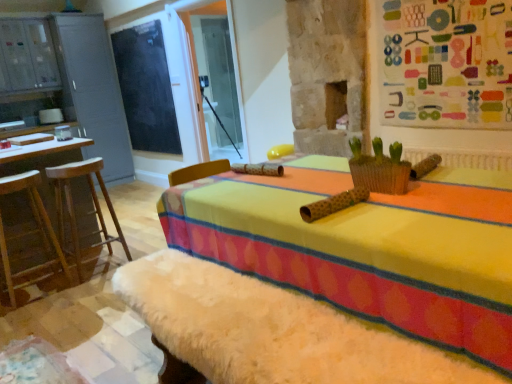
Question: Can woven brown basket at center be found inside blackboard at upper left?

Choices:
 (A) no
 (B) yes

Answer: (A)

Question: Does blackboard at upper left have a greater height compared to woven brown basket at center?

Choices:
 (A) yes
 (B) no

Answer: (A)

Question: From the image's perspective, is blackboard at upper left under woven brown basket at center?

Choices:
 (A) no
 (B) yes

Answer: (A)

Question: Is woven brown basket at center at the back of blackboard at upper left?

Choices:
 (A) yes
 (B) no

Answer: (B)

Question: Is blackboard at upper left further to camera compared to woven brown basket at center?

Choices:
 (A) yes
 (B) no

Answer: (A)

Question: Is blackboard at upper left in front of woven brown basket at center?

Choices:
 (A) no
 (B) yes

Answer: (A)

Question: Could matte gray cabinet at left be considered to be inside blackboard at upper left?

Choices:
 (A) no
 (B) yes

Answer: (A)

Question: Can you confirm if blackboard at upper left is bigger than matte gray cabinet at left?

Choices:
 (A) no
 (B) yes

Answer: (A)

Question: Considering the relative positions of blackboard at upper left and matte gray cabinet at left in the image provided, is blackboard at upper left to the right of matte gray cabinet at left from the viewer's perspective?

Choices:
 (A) yes
 (B) no

Answer: (A)

Question: Can you confirm if blackboard at upper left is thinner than matte gray cabinet at left?

Choices:
 (A) yes
 (B) no

Answer: (A)

Question: From a real-world perspective, is blackboard at upper left beneath matte gray cabinet at left?

Choices:
 (A) no
 (B) yes

Answer: (A)

Question: Is blackboard at upper left positioned far away from matte gray cabinet at left?

Choices:
 (A) no
 (B) yes

Answer: (A)

Question: Does blackboard at upper left have a lesser height compared to wooden stool at left, which appears as the first furniture when viewed from the left?

Choices:
 (A) no
 (B) yes

Answer: (A)